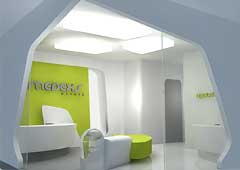
The width and height of the screenshot is (240, 170). What are the coordinates of `curved wall inset` in the screenshot? It's located at (103, 72), (108, 132).